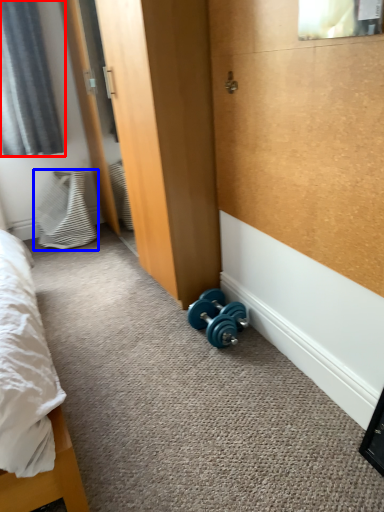
Question: Among these objects, which one is nearest to the camera, curtain (highlighted by a red box) or pillow (highlighted by a blue box)?

Choices:
 (A) curtain
 (B) pillow

Answer: (A)